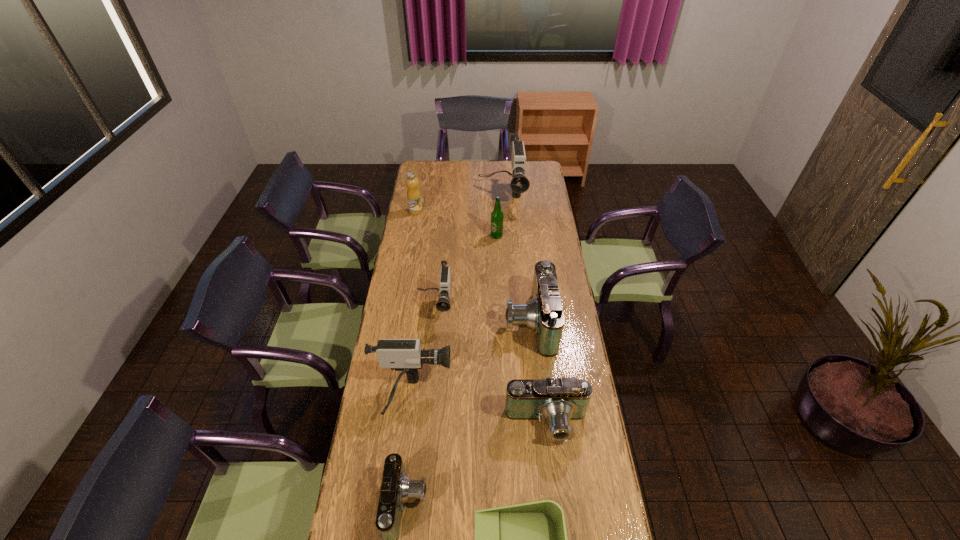
The image size is (960, 540). Find the location of `camcorder that is the sixth closest one to the beer bottle`. camcorder that is the sixth closest one to the beer bottle is located at coordinates (396, 489).

Select which camcorder appears as the second closest to the second biggest blue camcorder. Please provide its 2D coordinates. Your answer should be formatted as a tuple, i.e. [(x, y)], where the tuple contains the x and y coordinates of a point satisfying the conditions above.

[(405, 355)]

The height and width of the screenshot is (540, 960). Find the location of `the second closest white camcorder to the shortest camcorder`. the second closest white camcorder to the shortest camcorder is located at coordinates (443, 304).

Locate an element on the screen. white camcorder that is the second closest to the second shortest object is located at coordinates (443, 304).

Find the location of a particular element. Image resolution: width=960 pixels, height=540 pixels. blue camcorder that stands as the closest to the fruit juice is located at coordinates (543, 314).

Identify the location of blue camcorder that is the closest to the dustpan. Image resolution: width=960 pixels, height=540 pixels. (396, 489).